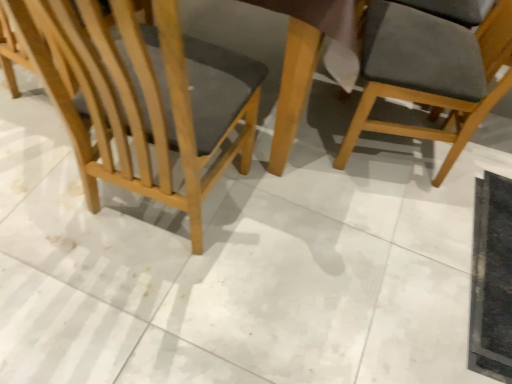
At what (x,y) coordinates should I click in order to perform the action: click on light brown wood chair at left, acting as the 2th chair starting from the right. Please return your answer as a coordinate pair (x, y). Image resolution: width=512 pixels, height=384 pixels. Looking at the image, I should click on (144, 96).

Describe the element at coordinates (144, 96) in the screenshot. I see `light brown wood chair at left, arranged as the first chair when viewed from the left` at that location.

The height and width of the screenshot is (384, 512). I want to click on dark gray fabric chair at upper right, the 2th chair positioned from the left, so click(431, 72).

Image resolution: width=512 pixels, height=384 pixels. What do you see at coordinates (431, 72) in the screenshot?
I see `dark gray fabric chair at upper right, the 2th chair positioned from the left` at bounding box center [431, 72].

The width and height of the screenshot is (512, 384). Identify the location of light brown wood chair at left, acting as the 2th chair starting from the right. (144, 96).

Which is more to the right, light brown wood chair at left, acting as the 2th chair starting from the right, or dark gray fabric chair at upper right, the 2th chair positioned from the left?

dark gray fabric chair at upper right, the 2th chair positioned from the left, is more to the right.

Relative to dark gray fabric chair at upper right, the 2th chair positioned from the left, is light brown wood chair at left, arranged as the first chair when viewed from the left, in front or behind?

Clearly, light brown wood chair at left, arranged as the first chair when viewed from the left, is in front of dark gray fabric chair at upper right, the 2th chair positioned from the left.

Is point (97, 177) closer to viewer compared to point (506, 43)?

Yes, point (97, 177) is in front of point (506, 43).

From the image's perspective, is light brown wood chair at left, arranged as the first chair when viewed from the left, located beneath dark gray fabric chair at upper right, the 2th chair positioned from the left?

Yes.

From the picture: From a real-world perspective, which is physically above, light brown wood chair at left, arranged as the first chair when viewed from the left, or dark gray fabric chair at upper right, marked as the 1th chair in a right-to-left arrangement?

From a 3D spatial view, light brown wood chair at left, arranged as the first chair when viewed from the left, is above.

Considering the sizes of objects light brown wood chair at left, arranged as the first chair when viewed from the left, and dark gray fabric chair at upper right, marked as the 1th chair in a right-to-left arrangement, in the image provided, who is thinner, light brown wood chair at left, arranged as the first chair when viewed from the left, or dark gray fabric chair at upper right, marked as the 1th chair in a right-to-left arrangement,?

Thinner between the two is dark gray fabric chair at upper right, marked as the 1th chair in a right-to-left arrangement.

Which of these two, light brown wood chair at left, arranged as the first chair when viewed from the left, or dark gray fabric chair at upper right, the 2th chair positioned from the left, stands shorter?

dark gray fabric chair at upper right, the 2th chair positioned from the left, is shorter.

Considering the relative sizes of light brown wood chair at left, arranged as the first chair when viewed from the left, and dark gray fabric chair at upper right, marked as the 1th chair in a right-to-left arrangement, in the image provided, is light brown wood chair at left, arranged as the first chair when viewed from the left, bigger than dark gray fabric chair at upper right, marked as the 1th chair in a right-to-left arrangement,?

Indeed, light brown wood chair at left, arranged as the first chair when viewed from the left, has a larger size compared to dark gray fabric chair at upper right, marked as the 1th chair in a right-to-left arrangement.

Does light brown wood chair at left, arranged as the first chair when viewed from the left, contain dark gray fabric chair at upper right, marked as the 1th chair in a right-to-left arrangement?

No, light brown wood chair at left, arranged as the first chair when viewed from the left, does not contain dark gray fabric chair at upper right, marked as the 1th chair in a right-to-left arrangement.

Would you say light brown wood chair at left, acting as the 2th chair starting from the right, is a long distance from dark gray fabric chair at upper right, marked as the 1th chair in a right-to-left arrangement?

No, light brown wood chair at left, acting as the 2th chair starting from the right, is in close proximity to dark gray fabric chair at upper right, marked as the 1th chair in a right-to-left arrangement.

Could you tell me if light brown wood chair at left, acting as the 2th chair starting from the right, is facing dark gray fabric chair at upper right, the 2th chair positioned from the left?

No, light brown wood chair at left, acting as the 2th chair starting from the right, is not facing towards dark gray fabric chair at upper right, the 2th chair positioned from the left.

What's the angular difference between light brown wood chair at left, arranged as the first chair when viewed from the left, and dark gray fabric chair at upper right, the 2th chair positioned from the left,'s facing directions?

There is a 97.3-degree angle between the facing directions of light brown wood chair at left, arranged as the first chair when viewed from the left, and dark gray fabric chair at upper right, the 2th chair positioned from the left.

How much distance is there between light brown wood chair at left, arranged as the first chair when viewed from the left, and dark gray fabric chair at upper right, the 2th chair positioned from the left?

A distance of 25.44 inches exists between light brown wood chair at left, arranged as the first chair when viewed from the left, and dark gray fabric chair at upper right, the 2th chair positioned from the left.

This screenshot has width=512, height=384. I want to click on chair that appears above the dark gray fabric chair at upper right, marked as the 1th chair in a right-to-left arrangement (from a real-world perspective), so click(144, 96).

Which object is positioned more to the right, dark gray fabric chair at upper right, the 2th chair positioned from the left, or light brown wood chair at left, acting as the 2th chair starting from the right?

dark gray fabric chair at upper right, the 2th chair positioned from the left, is more to the right.

Consider the image. In the image, is dark gray fabric chair at upper right, the 2th chair positioned from the left, positioned in front of or behind light brown wood chair at left, acting as the 2th chair starting from the right?

Clearly, dark gray fabric chair at upper right, the 2th chair positioned from the left, is behind light brown wood chair at left, acting as the 2th chair starting from the right.

Which is behind, point (391, 53) or point (178, 102)?

Point (391, 53)

From the image's perspective, relative to light brown wood chair at left, acting as the 2th chair starting from the right, is dark gray fabric chair at upper right, marked as the 1th chair in a right-to-left arrangement, above or below?

Clearly, from the image's perspective, dark gray fabric chair at upper right, marked as the 1th chair in a right-to-left arrangement, is above light brown wood chair at left, acting as the 2th chair starting from the right.

Based on the photo, from a real-world perspective, between dark gray fabric chair at upper right, marked as the 1th chair in a right-to-left arrangement, and light brown wood chair at left, acting as the 2th chair starting from the right, who is vertically lower?

In real-world perspective, dark gray fabric chair at upper right, marked as the 1th chair in a right-to-left arrangement, is lower.

Is dark gray fabric chair at upper right, marked as the 1th chair in a right-to-left arrangement, wider or thinner than light brown wood chair at left, arranged as the first chair when viewed from the left?

Considering their sizes, dark gray fabric chair at upper right, marked as the 1th chair in a right-to-left arrangement, looks slimmer than light brown wood chair at left, arranged as the first chair when viewed from the left.

Between dark gray fabric chair at upper right, the 2th chair positioned from the left, and light brown wood chair at left, arranged as the first chair when viewed from the left, which one has more height?

light brown wood chair at left, arranged as the first chair when viewed from the left.

Considering the relative sizes of dark gray fabric chair at upper right, the 2th chair positioned from the left, and light brown wood chair at left, arranged as the first chair when viewed from the left, in the image provided, is dark gray fabric chair at upper right, the 2th chair positioned from the left, smaller than light brown wood chair at left, arranged as the first chair when viewed from the left,?

Correct, dark gray fabric chair at upper right, the 2th chair positioned from the left, occupies less space than light brown wood chair at left, arranged as the first chair when viewed from the left.

Is dark gray fabric chair at upper right, the 2th chair positioned from the left, not inside light brown wood chair at left, acting as the 2th chair starting from the right?

Absolutely, dark gray fabric chair at upper right, the 2th chair positioned from the left, is external to light brown wood chair at left, acting as the 2th chair starting from the right.

Are dark gray fabric chair at upper right, marked as the 1th chair in a right-to-left arrangement, and light brown wood chair at left, acting as the 2th chair starting from the right, making contact?

dark gray fabric chair at upper right, marked as the 1th chair in a right-to-left arrangement, is not next to light brown wood chair at left, acting as the 2th chair starting from the right, and they're not touching.

Does dark gray fabric chair at upper right, marked as the 1th chair in a right-to-left arrangement, turn towards light brown wood chair at left, acting as the 2th chair starting from the right?

No, dark gray fabric chair at upper right, marked as the 1th chair in a right-to-left arrangement, does not turn towards light brown wood chair at left, acting as the 2th chair starting from the right.

Measure the distance between dark gray fabric chair at upper right, the 2th chair positioned from the left, and light brown wood chair at left, acting as the 2th chair starting from the right.

dark gray fabric chair at upper right, the 2th chair positioned from the left, and light brown wood chair at left, acting as the 2th chair starting from the right, are 25.44 inches apart from each other.

Image resolution: width=512 pixels, height=384 pixels. Find the location of `chair located behind the light brown wood chair at left, arranged as the first chair when viewed from the left`. chair located behind the light brown wood chair at left, arranged as the first chair when viewed from the left is located at coordinates (431, 72).

I want to click on chair below the light brown wood chair at left, acting as the 2th chair starting from the right (from a real-world perspective), so click(x=431, y=72).

Where is `chair on the right side of light brown wood chair at left, acting as the 2th chair starting from the right`? The height and width of the screenshot is (384, 512). chair on the right side of light brown wood chair at left, acting as the 2th chair starting from the right is located at coordinates (431, 72).